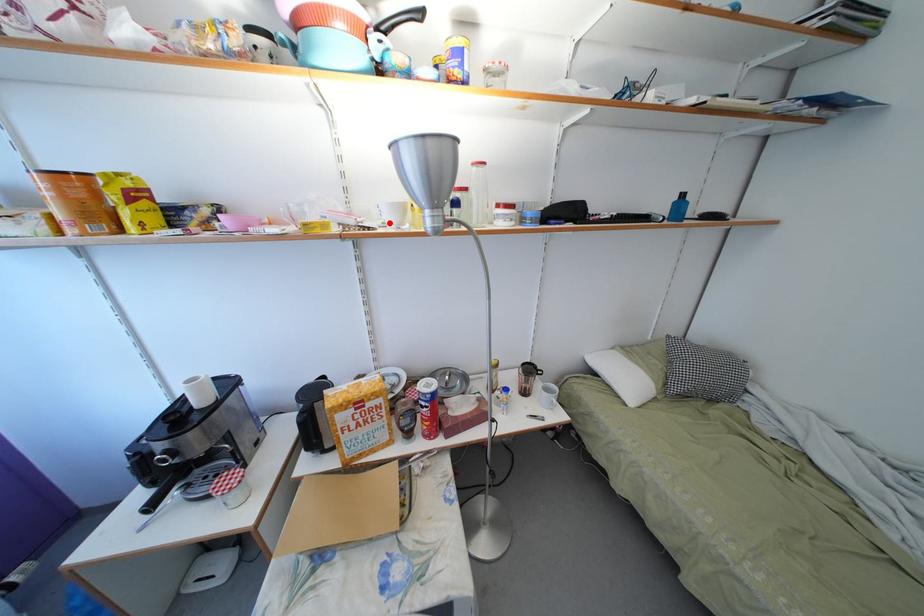
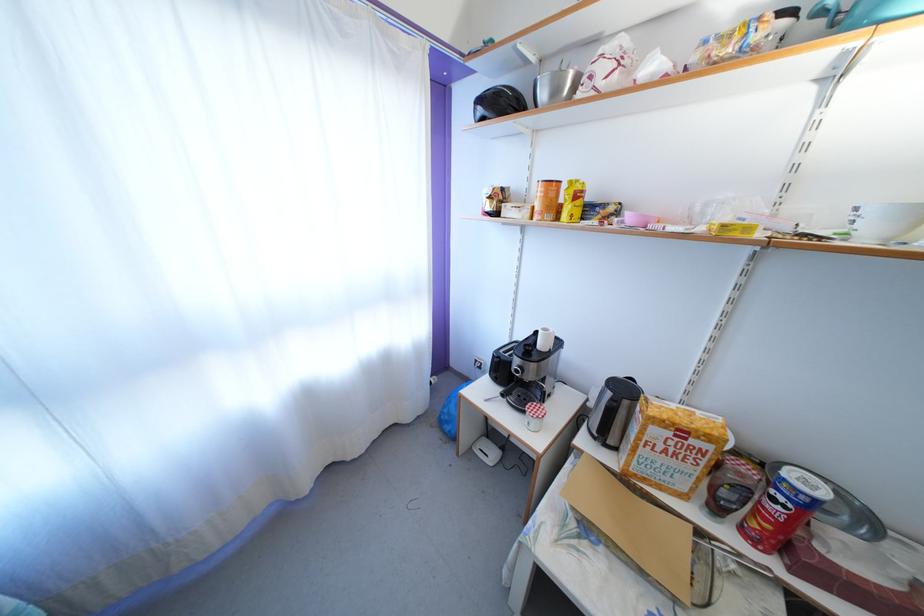
Find the pixel in the second image that matches the highlighted location in the first image.

(862, 232)